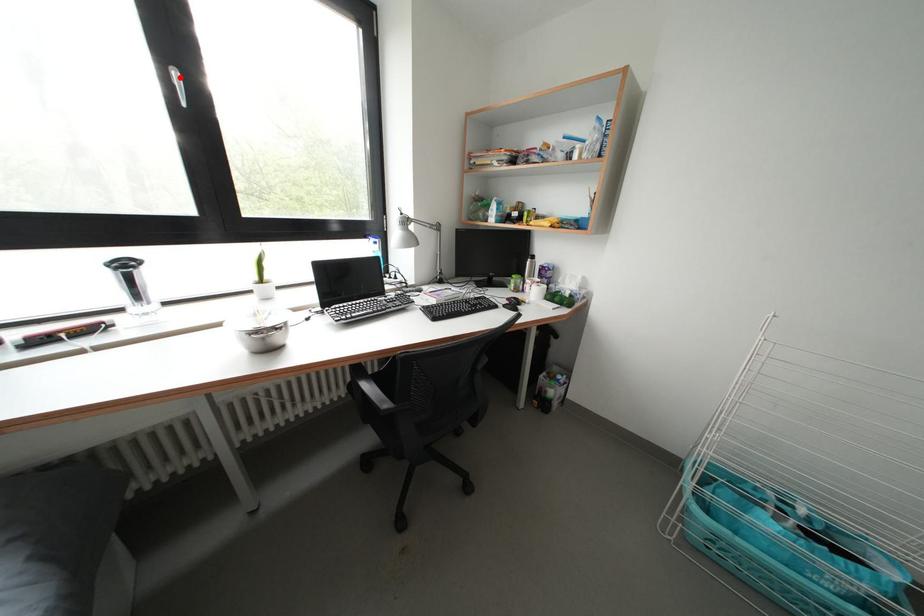
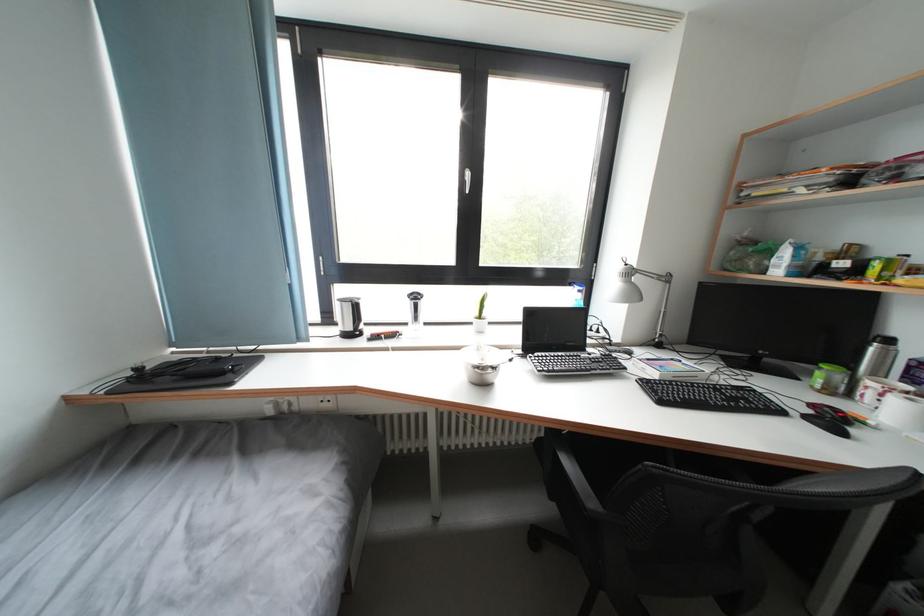
In the second image, find the point that corresponds to the highlighted location in the first image.

(473, 177)